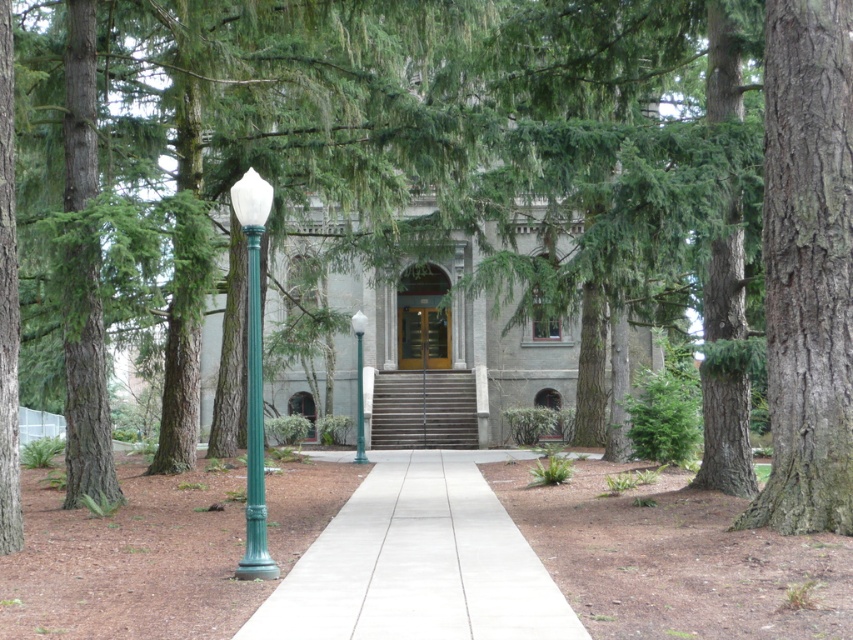
Question: Which of the following is the farthest from the observer?

Choices:
 (A) smooth bark tree at right
 (B) concrete at center

Answer: (A)

Question: Does smooth bark tree at right appear on the right side of concrete at center?

Choices:
 (A) yes
 (B) no

Answer: (A)

Question: Which point appears farthest from the camera in this image?

Choices:
 (A) 358,332
 (B) 547,596
 (C) 838,529
 (D) 247,324

Answer: (A)

Question: Among these objects, which one is farthest from the camera?

Choices:
 (A) green matte lamp post at center
 (B) green glass pole at center

Answer: (B)

Question: Is green matte lamp post at center wider than green glass pole at center?

Choices:
 (A) yes
 (B) no

Answer: (B)

Question: Observing the image, what is the correct spatial positioning of smooth bark tree at right in reference to green glass pole at center?

Choices:
 (A) above
 (B) below

Answer: (A)